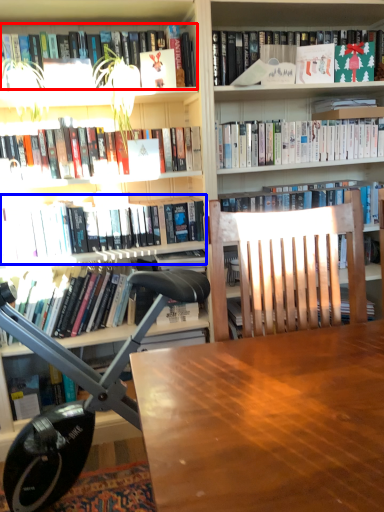
Question: Which of the following is the farthest to the observer, book (highlighted by a red box) or book (highlighted by a blue box)?

Choices:
 (A) book
 (B) book

Answer: (B)